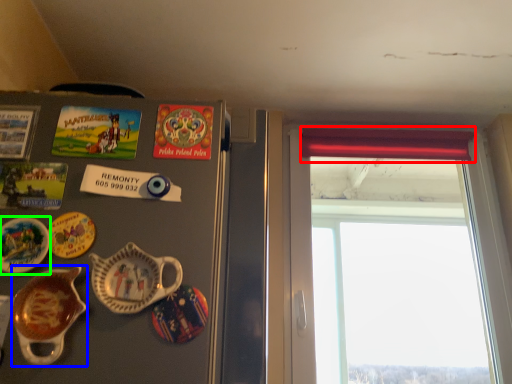
Question: Estimate the real-world distances between objects in this image. Which object is closer to curtain (highlighted by a red box), tableware (highlighted by a blue box) or plate (highlighted by a green box)?

Choices:
 (A) tableware
 (B) plate

Answer: (A)